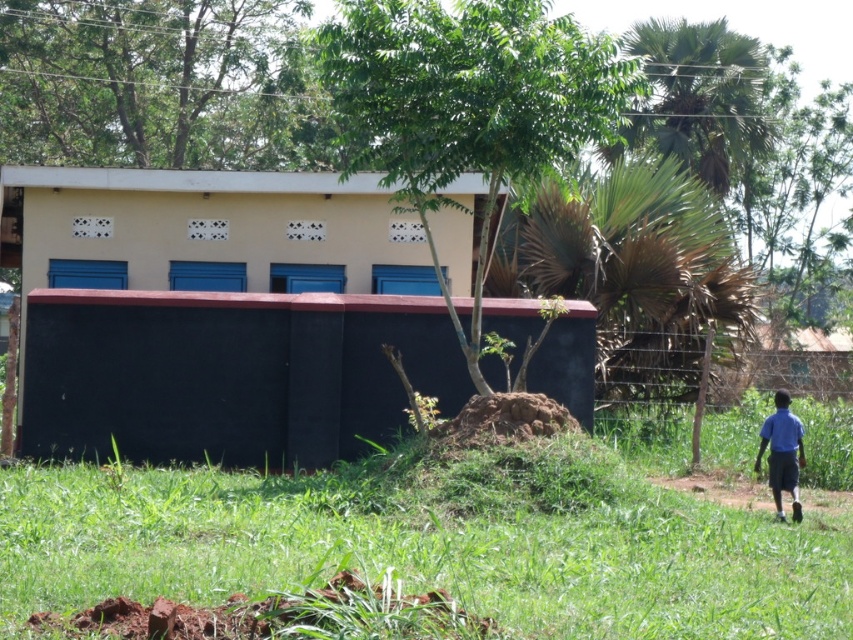
Question: Which point appears farthest from the camera in this image?

Choices:
 (A) (779, 621)
 (B) (785, 397)
 (C) (245, 221)

Answer: (C)

Question: Which of these objects is positioned closest to the green grassy at lower right?

Choices:
 (A) blue fabric shirt at right
 (B) yellow matte building at center

Answer: (A)

Question: Is yellow matte building at center bigger than blue fabric shirt at right?

Choices:
 (A) yes
 (B) no

Answer: (B)

Question: Which of the following is the closest to the observer?

Choices:
 (A) (796, 481)
 (B) (573, 624)
 (C) (77, 394)

Answer: (B)

Question: In this image, where is yellow matte building at center located relative to green grassy at lower right?

Choices:
 (A) below
 (B) above

Answer: (B)

Question: Is yellow matte building at center to the right of blue fabric shirt at right from the viewer's perspective?

Choices:
 (A) yes
 (B) no

Answer: (B)